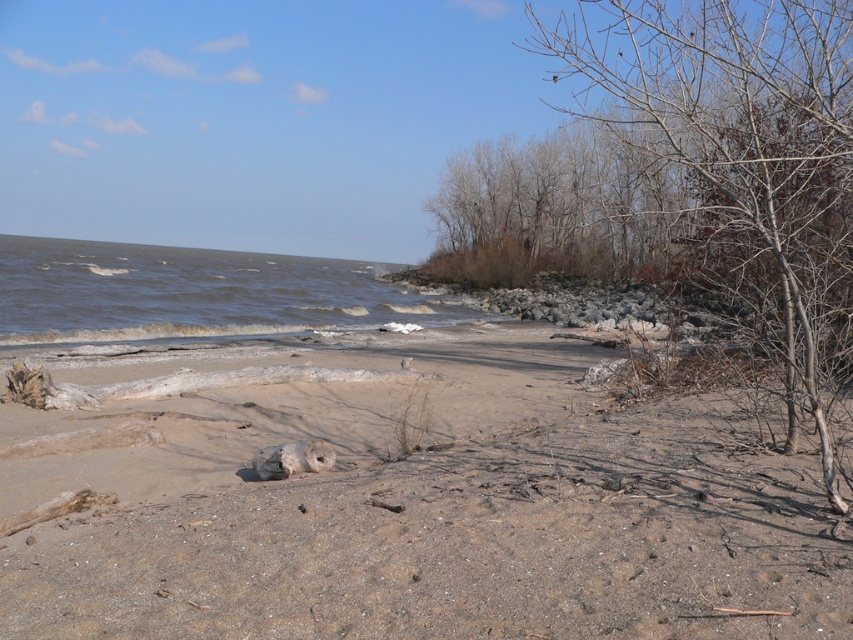
Is point (786, 346) more distant than point (262, 458)?

No, (786, 346) is in front of (262, 458).

Can you confirm if bare branches at right is positioned above white sandstone at center?

Correct, bare branches at right is located above white sandstone at center.

You are a GUI agent. You are given a task and a screenshot of the screen. Output one action in this format:
    pyautogui.click(x=<x>, y=<y>)
    Task: Click on the bare branches at right
    The height and width of the screenshot is (640, 853).
    Given the screenshot: What is the action you would take?
    pyautogui.click(x=738, y=161)

Does point (347, 612) lie in front of point (537, 35)?

Yes, point (347, 612) is closer to viewer.

Can you confirm if brown sandy beach at center is thinner than bare branches at right?

Correct, brown sandy beach at center's width is less than bare branches at right's.

Between point (163, 556) and point (747, 285), which one is positioned behind?

Point (747, 285)

Where is `brown sandy beach at center`? The image size is (853, 640). brown sandy beach at center is located at coordinates (410, 506).

Between brown sandy beach at center and white sandstone at center, which one appears on the left side from the viewer's perspective?

From the viewer's perspective, white sandstone at center appears more on the left side.

Which is more to the right, brown sandy beach at center or white sandstone at center?

brown sandy beach at center is more to the right.

This screenshot has width=853, height=640. I want to click on brown sandy beach at center, so (x=410, y=506).